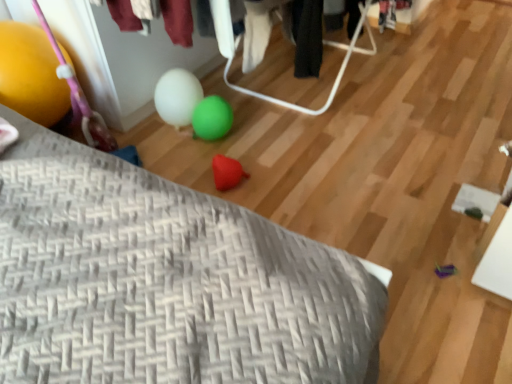
You are a GUI agent. You are given a task and a screenshot of the screen. Output one action in this format:
    pyautogui.click(x=<x>, y=<y>)
    Task: Click on the free space in front of rubber heart at center
    This screenshot has width=512, height=384.
    Given the screenshot: What is the action you would take?
    pyautogui.click(x=251, y=203)